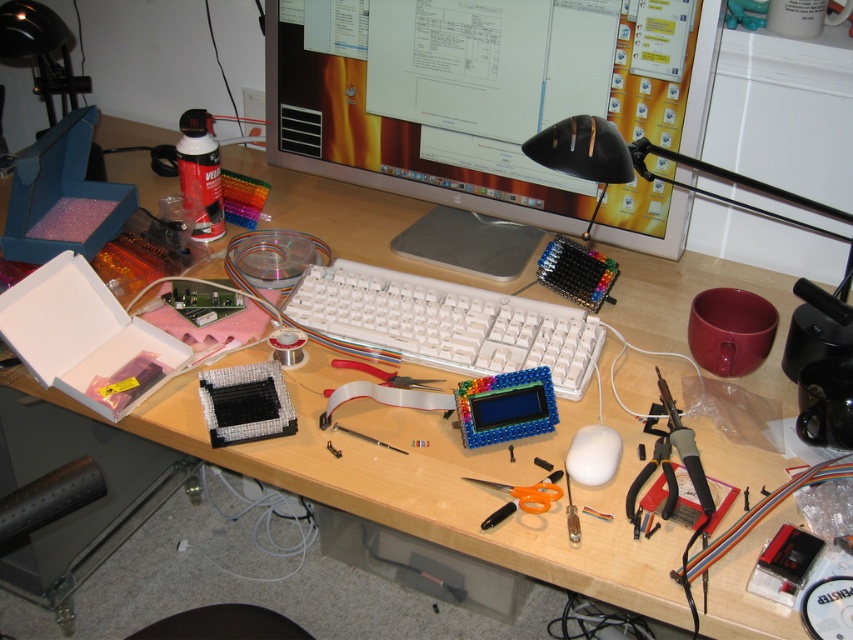
Question: Estimate the real-world distances between objects in this image. Which object is closer to the matte black monitor at center?

Choices:
 (A) metallic silver pliers at lower right
 (B) orange plastic scissors at center
 (C) white plastic keyboard at center
 (D) white matte mouse at center-right

Answer: (C)

Question: Which point is closer to the camera taking this photo?

Choices:
 (A) (554, 481)
 (B) (680, 112)

Answer: (A)

Question: Is metallic silver pliers at lower right to the right of white matte mouse at center-right from the viewer's perspective?

Choices:
 (A) yes
 (B) no

Answer: (A)

Question: Can you confirm if white plastic keyboard at center is smaller than orange plastic scissors at center?

Choices:
 (A) yes
 (B) no

Answer: (B)

Question: Among these objects, which one is nearest to the camera?

Choices:
 (A) white plastic keyboard at center
 (B) white matte mouse at center-right
 (C) matte black monitor at center

Answer: (B)

Question: Where is white matte mouse at center-right located in relation to orange plastic scissors at center in the image?

Choices:
 (A) below
 (B) above

Answer: (B)